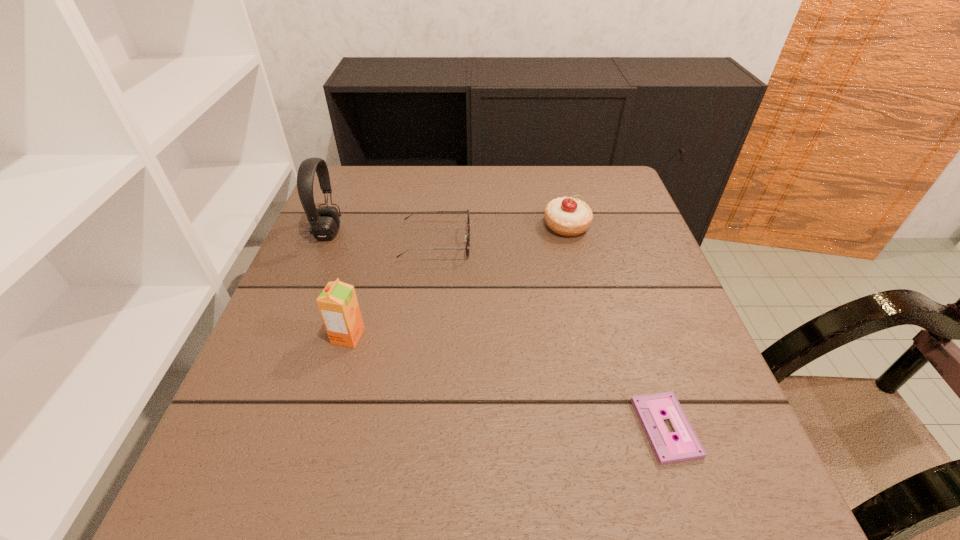
This screenshot has height=540, width=960. I want to click on free space at the left edge of the desktop, so click(312, 396).

Where is `free space at the right edge of the desktop`? This screenshot has width=960, height=540. free space at the right edge of the desktop is located at coordinates (639, 222).

Image resolution: width=960 pixels, height=540 pixels. I want to click on free spot at the far left corner of the desktop, so click(384, 206).

In the image, there is a desktop. Identify the location of vacant space at the far right corner. This screenshot has height=540, width=960. (615, 190).

Locate an element on the screen. This screenshot has height=540, width=960. free area in between the third tallest object and the fourth tallest object is located at coordinates (501, 235).

Image resolution: width=960 pixels, height=540 pixels. In order to click on free area in between the third object from left to right and the videotape in this screenshot , I will do `click(551, 336)`.

Locate an element on the screen. The width and height of the screenshot is (960, 540). vacant area that lies between the shortest object and the third tallest object is located at coordinates (616, 327).

Locate an element on the screen. Image resolution: width=960 pixels, height=540 pixels. blank region between the leftmost object and the shortest object is located at coordinates (497, 330).

The width and height of the screenshot is (960, 540). I want to click on free space between the second tallest object and the pastry, so click(457, 281).

The height and width of the screenshot is (540, 960). What are the coordinates of `blank region between the nearest object and the third object from right to left` in the screenshot? It's located at (551, 336).